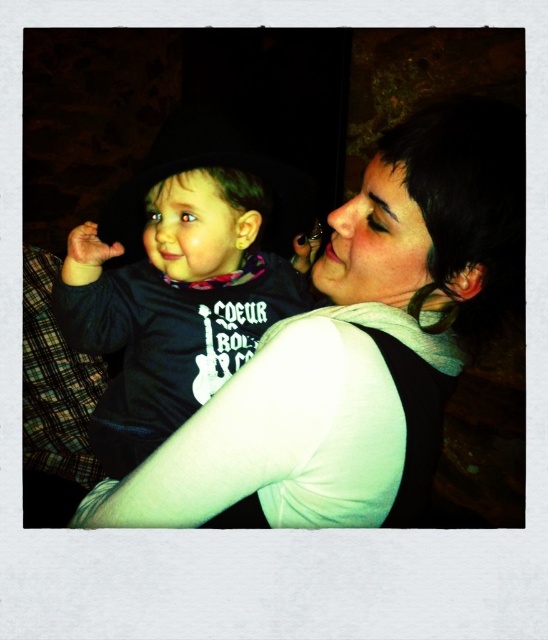
You are designing a clothing catalog and need to place the matte black shirt at center and the matte black hoodie at center on a mannequin. Which item should be placed first if you want to ensure the larger size is visible above the smaller one?

The matte black shirt at center should be placed first because it is larger in size compared to the matte black hoodie at center, allowing it to be positioned underneath so the smaller hoodie can be placed on top and still be visible.

You are a photographer setting up a shoot in this scene. You need to place a small prop between the two black items, matte black shirt at center and matte black hoodie at center. Based on their positions, which item should the prop be placed to the left of?

The prop should be placed to the left of the matte black shirt at center because the matte black shirt at center is to the right of the matte black hoodie at center, so the hoodie is on the left side and the shirt is on the right side.

You are a photographer trying to capture a candid shot of the two people in the scene. You notice the matte black shirt at center and the matte black hoodie at center. Which one is taller in the image?

The matte black shirt at center is much taller than the matte black hoodie at center in the image.